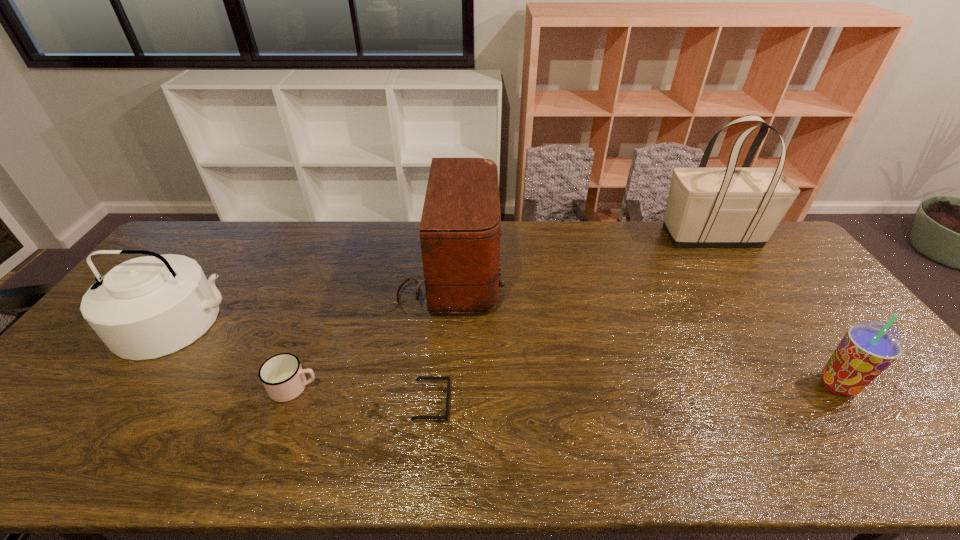
Image resolution: width=960 pixels, height=540 pixels. Identify the location of the tallest object. (730, 206).

Locate an element on the screen. radio receiver is located at coordinates (460, 229).

Identify the location of the leftmost object. (147, 307).

Locate an element on the screen. The width and height of the screenshot is (960, 540). smoothie is located at coordinates (868, 348).

Identify the location of mug. (284, 379).

Locate an element on the screen. This screenshot has width=960, height=540. the fifth tallest object is located at coordinates (284, 379).

This screenshot has height=540, width=960. Find the location of `the shortest object`. the shortest object is located at coordinates (447, 378).

Find the location of a particular element. This screenshot has height=540, width=960. blank space located 0.310m with handles facing forward on the shopping bag is located at coordinates (574, 237).

Find the location of a particular element. The height and width of the screenshot is (540, 960). vacant space situated with handles facing forward on the shopping bag is located at coordinates (591, 237).

Where is `free space located 0.180m with handles facing forward on the shopping bag`? The width and height of the screenshot is (960, 540). free space located 0.180m with handles facing forward on the shopping bag is located at coordinates (611, 237).